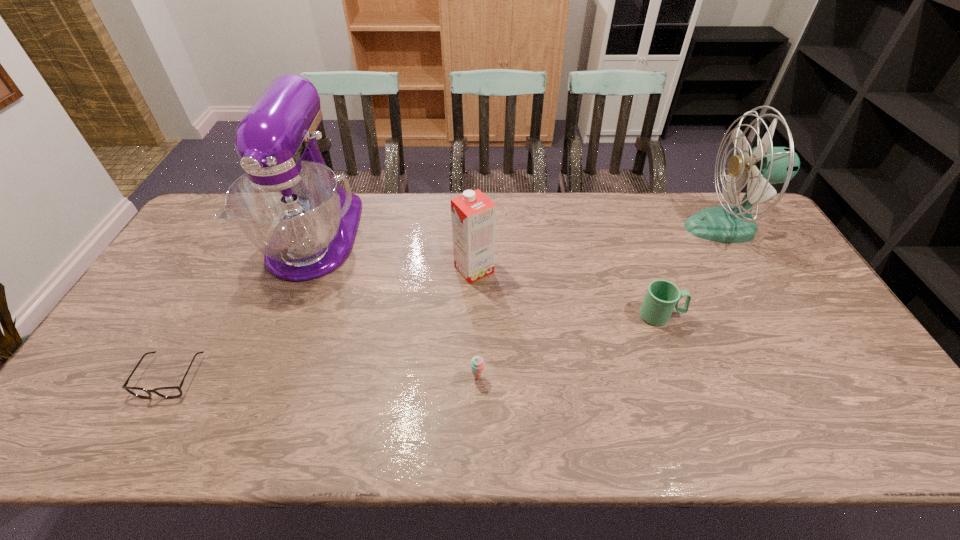
The width and height of the screenshot is (960, 540). In the image, there is a desktop. What are the coordinates of `vacant space at the far edge` in the screenshot? It's located at (383, 204).

The image size is (960, 540). Find the location of `free location at the near edge of the desktop`. free location at the near edge of the desktop is located at coordinates (363, 416).

In the image, there is a desktop. Where is `vacant space at the right edge`? The image size is (960, 540). vacant space at the right edge is located at coordinates (823, 328).

This screenshot has width=960, height=540. I want to click on free space between the fan and the sherbert, so click(x=601, y=302).

Image resolution: width=960 pixels, height=540 pixels. Identify the location of vacant space in between the mixer and the third tallest object. (395, 253).

At what (x,y) coordinates should I click in order to perform the action: click on free space that is in between the second object from left to right and the third nearest object. Please return your answer as a coordinate pair (x, y). The width and height of the screenshot is (960, 540). Looking at the image, I should click on (488, 276).

Identify the location of empty location between the carton and the sherbert. The height and width of the screenshot is (540, 960). (x=476, y=323).

You are a GUI agent. You are given a task and a screenshot of the screen. Output one action in this format:
    pyautogui.click(x=<x>, y=<y>)
    Task: Click on the free area in between the second object from left to right and the third nearest object
    
    Given the screenshot: What is the action you would take?
    pyautogui.click(x=488, y=276)

This screenshot has width=960, height=540. I want to click on free spot between the sherbert and the spectacles, so click(324, 377).

This screenshot has width=960, height=540. Identify the location of free space between the shortest object and the fan. (447, 302).